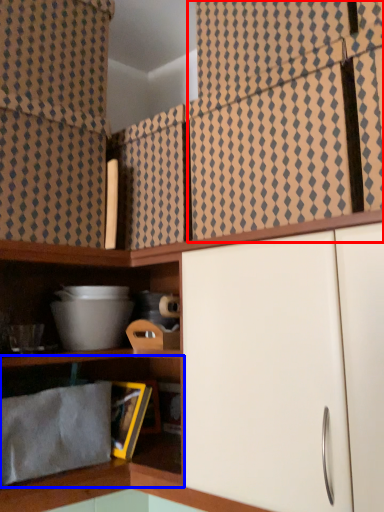
Question: Which of the following is the farthest to the observer, curtain (highlighted by a red box) or shelf (highlighted by a blue box)?

Choices:
 (A) curtain
 (B) shelf

Answer: (B)